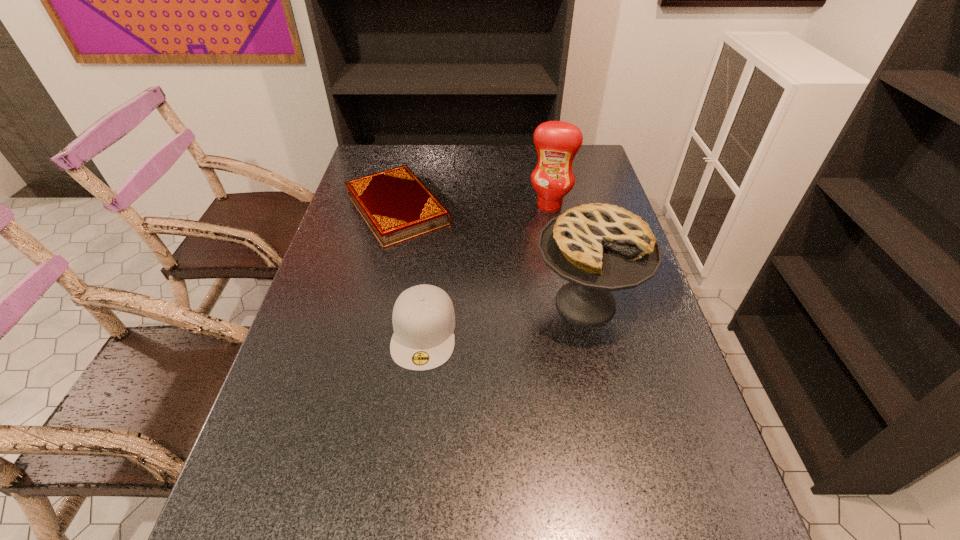
Where is `free space located on the label side of the condiment`? The image size is (960, 540). free space located on the label side of the condiment is located at coordinates (521, 301).

This screenshot has height=540, width=960. I want to click on vacant space located on the label side of the condiment, so click(540, 232).

Find the location of a particular element. Image resolution: width=960 pixels, height=540 pixels. object that is positioned at the far edge is located at coordinates (395, 204).

In order to click on object that is positioned at the left edge in this screenshot , I will do `click(395, 204)`.

Find the location of a particular element. pie that is at the right edge is located at coordinates pyautogui.click(x=599, y=248).

Locate an element on the screen. The height and width of the screenshot is (540, 960). condiment positioned at the right edge is located at coordinates (557, 143).

The height and width of the screenshot is (540, 960). Identify the location of object that is positioned at the far left corner. (395, 204).

Find the location of a particular element. The image size is (960, 540). free region at the far edge of the desktop is located at coordinates (411, 146).

I want to click on vacant space at the near edge of the desktop, so click(x=396, y=465).

Where is `vacant space at the left edge of the desktop`? Image resolution: width=960 pixels, height=540 pixels. vacant space at the left edge of the desktop is located at coordinates (348, 267).